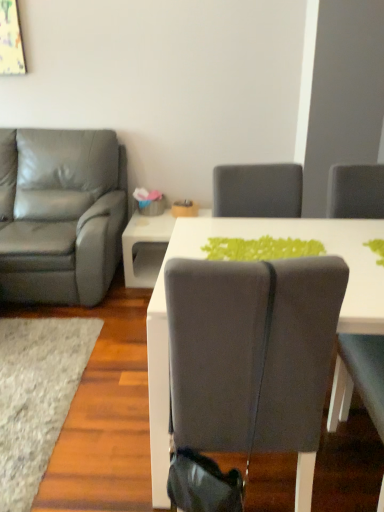
Question: Is matte gray leather armchair at left, acting as the 2th chair starting from the front, shorter than soft gray carpet at lower left?

Choices:
 (A) no
 (B) yes

Answer: (A)

Question: From a real-world perspective, is matte gray leather armchair at left, positioned as the first chair in back-to-front order, positioned under soft gray carpet at lower left based on gravity?

Choices:
 (A) yes
 (B) no

Answer: (B)

Question: From the image's perspective, is matte gray leather armchair at left, acting as the 2th chair starting from the front, under soft gray carpet at lower left?

Choices:
 (A) yes
 (B) no

Answer: (B)

Question: Is matte gray leather armchair at left, which ranks as the second chair in right-to-left order, not near soft gray carpet at lower left?

Choices:
 (A) yes
 (B) no

Answer: (B)

Question: Considering the relative sizes of matte gray leather armchair at left, positioned as the first chair in back-to-front order, and soft gray carpet at lower left in the image provided, is matte gray leather armchair at left, positioned as the first chair in back-to-front order, wider than soft gray carpet at lower left?

Choices:
 (A) yes
 (B) no

Answer: (B)

Question: Is soft gray carpet at lower left inside matte gray leather armchair at left, marked as the 1th chair in a left-to-right arrangement?

Choices:
 (A) yes
 (B) no

Answer: (B)

Question: Considering the relative sizes of matte gray leather armchair at left, marked as the 1th chair in a left-to-right arrangement, and white glossy table at center in the image provided, is matte gray leather armchair at left, marked as the 1th chair in a left-to-right arrangement, bigger than white glossy table at center?

Choices:
 (A) yes
 (B) no

Answer: (A)

Question: From the image's perspective, is matte gray leather armchair at left, positioned as the first chair in back-to-front order, under white glossy table at center?

Choices:
 (A) yes
 (B) no

Answer: (B)

Question: Can you confirm if matte gray leather armchair at left, positioned as the first chair in back-to-front order, is wider than white glossy table at center?

Choices:
 (A) yes
 (B) no

Answer: (A)

Question: Is white glossy table at center surrounded by matte gray leather armchair at left, positioned as the first chair in back-to-front order?

Choices:
 (A) yes
 (B) no

Answer: (B)

Question: Is matte gray leather armchair at left, acting as the 2th chair starting from the front, taller than white glossy table at center?

Choices:
 (A) no
 (B) yes

Answer: (B)

Question: From the image's perspective, would you say matte gray leather armchair at left, which ranks as the second chair in right-to-left order, is shown under matte gray chair at center, the 1th chair from the front?

Choices:
 (A) no
 (B) yes

Answer: (A)